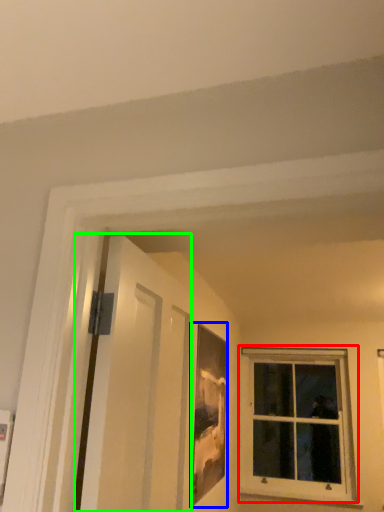
Question: Based on their relative distances, which object is farther from window (highlighted by a red box)? Choose from picture frame (highlighted by a blue box) and screen door (highlighted by a green box).

Choices:
 (A) picture frame
 (B) screen door

Answer: (B)